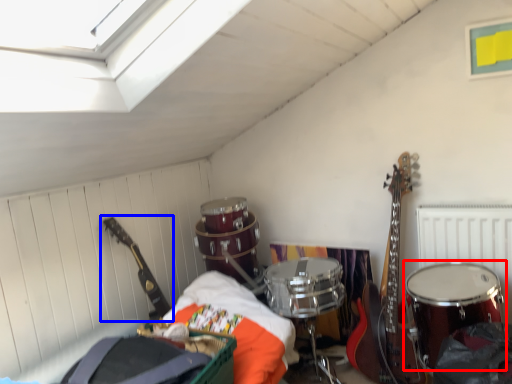
Question: Which point is further to the camera, drum (highlighted by a red box) or guitar (highlighted by a blue box)?

Choices:
 (A) drum
 (B) guitar

Answer: (B)